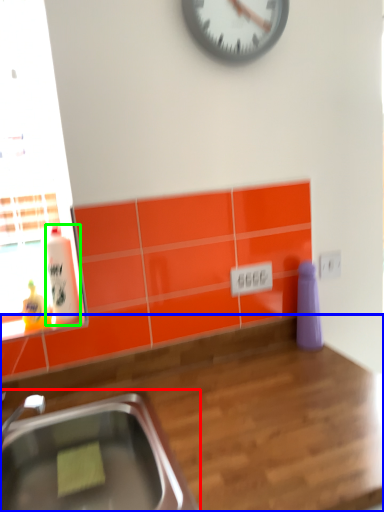
Question: Which object is the farthest from sink (highlighted by a red box)? Choose among these: countertop (highlighted by a blue box) or bottle (highlighted by a green box).

Choices:
 (A) countertop
 (B) bottle

Answer: (B)